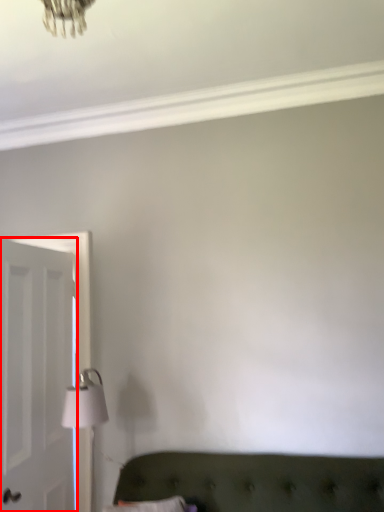
Question: From the image's perspective, where is door (annotated by the red box) located relative to table lamp?

Choices:
 (A) below
 (B) above

Answer: (B)